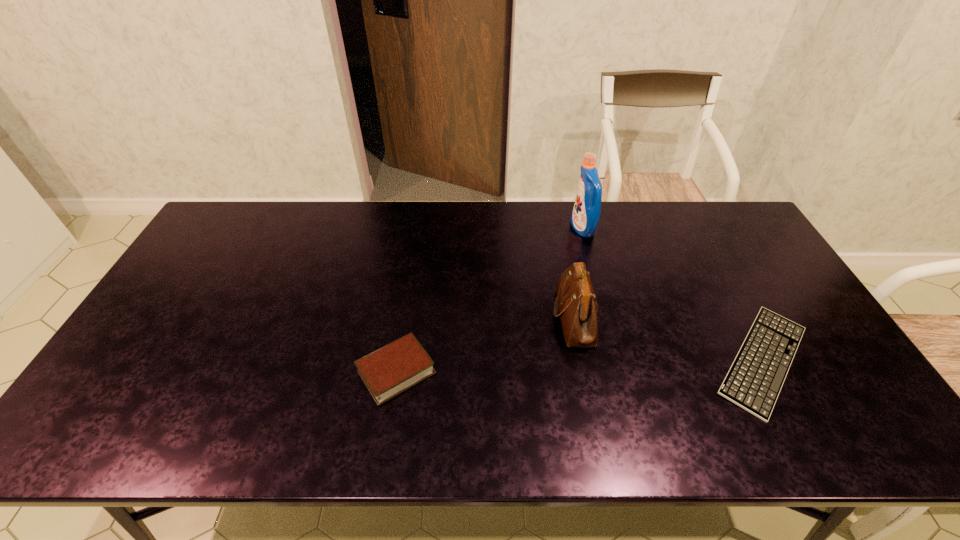
Find the location of a particular element. The height and width of the screenshot is (540, 960). the tallest object is located at coordinates (585, 216).

Image resolution: width=960 pixels, height=540 pixels. Identify the location of detergent. [x=585, y=216].

Locate an element on the screen. The width and height of the screenshot is (960, 540). the second tallest object is located at coordinates (575, 304).

Find the location of a particular element. The width and height of the screenshot is (960, 540). Bible is located at coordinates (392, 369).

Identify the location of the second shortest object. (392, 369).

At what (x,y) coordinates should I click in order to perform the action: click on the shortest object. Please return your answer as a coordinate pair (x, y). Looking at the image, I should click on (755, 378).

The height and width of the screenshot is (540, 960). I want to click on computer keyboard, so click(x=755, y=378).

This screenshot has width=960, height=540. Find the location of `vacant space located on the label of the farthest object`. vacant space located on the label of the farthest object is located at coordinates (522, 228).

In order to click on vacant space located on the label of the farthest object in this screenshot , I will do 491,228.

At what (x,y) coordinates should I click in order to perform the action: click on vacant space situated on the label of the farthest object. Please return your answer as a coordinate pair (x, y). This screenshot has width=960, height=540. Looking at the image, I should click on (514, 228).